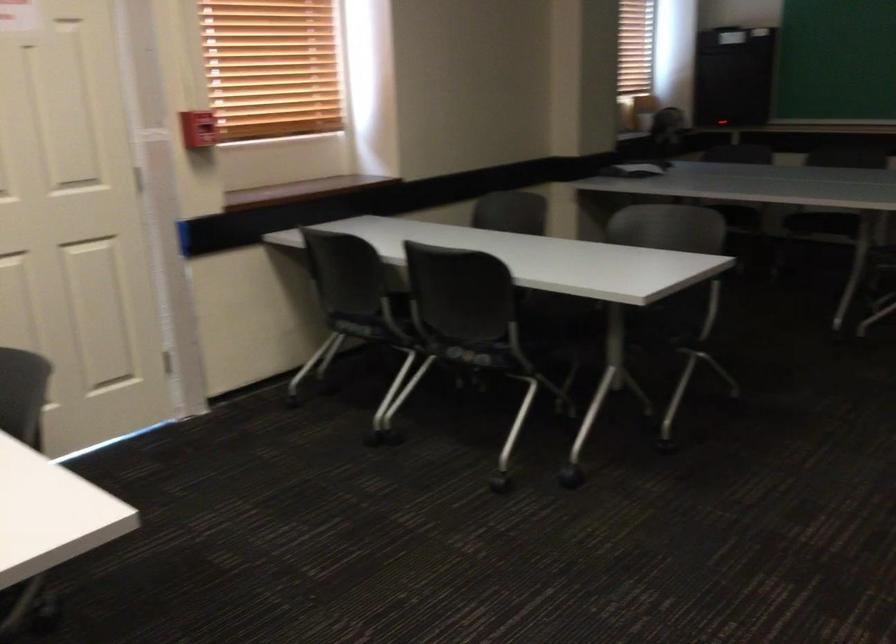
Find where to pull the red fire alarm handle. Please return your answer as a coordinate pair (x, y).

(197, 128)